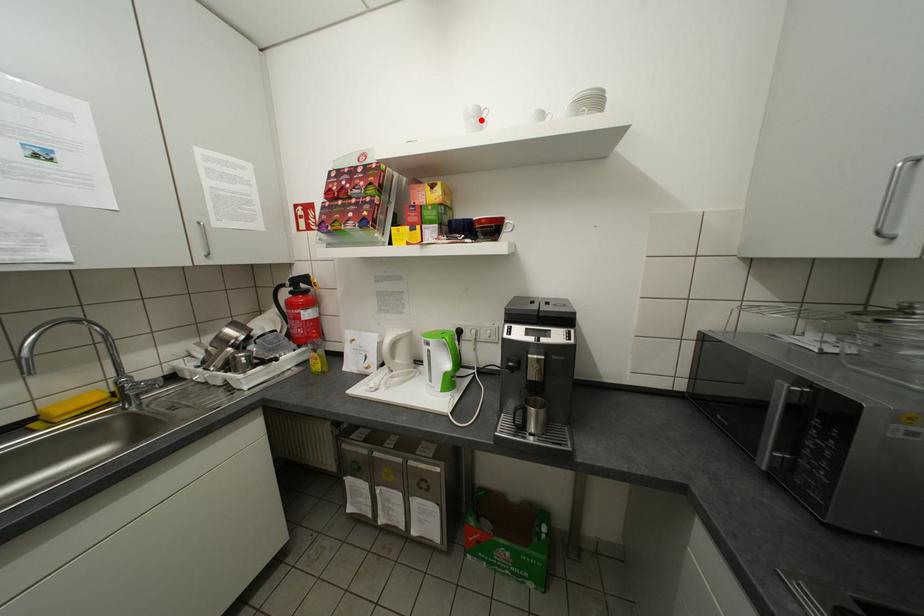
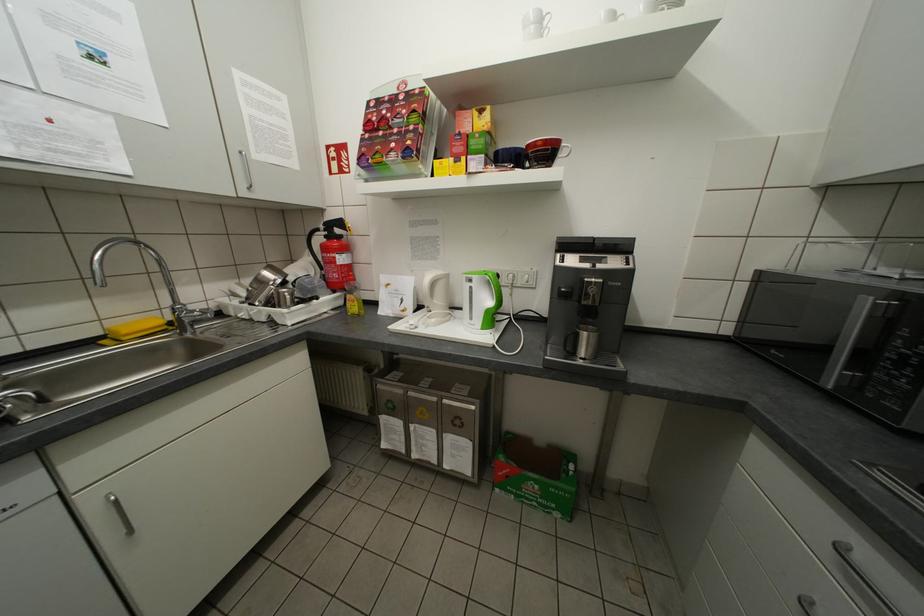
Where in the second image is the point corresponding to the highlighted location from the first image?

(541, 28)